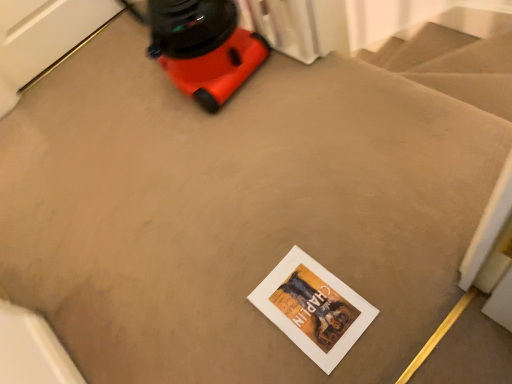
Question: Considering the positions of point (185, 9) and point (286, 279), is point (185, 9) closer or farther from the camera than point (286, 279)?

Choices:
 (A) closer
 (B) farther

Answer: (B)

Question: Visually, is orange plastic vacuum cleaner at upper left positioned to the left or to the right of white matte postcard at center?

Choices:
 (A) left
 (B) right

Answer: (A)

Question: From the image's perspective, is orange plastic vacuum cleaner at upper left located above or below white matte postcard at center?

Choices:
 (A) above
 (B) below

Answer: (A)

Question: Based on their sizes in the image, would you say white matte postcard at center is bigger or smaller than orange plastic vacuum cleaner at upper left?

Choices:
 (A) small
 (B) big

Answer: (A)

Question: From their relative heights in the image, would you say white matte postcard at center is taller or shorter than orange plastic vacuum cleaner at upper left?

Choices:
 (A) tall
 (B) short

Answer: (B)

Question: Considering the positions of white matte postcard at center and orange plastic vacuum cleaner at upper left in the image, is white matte postcard at center wider or thinner than orange plastic vacuum cleaner at upper left?

Choices:
 (A) wide
 (B) thin

Answer: (B)

Question: Is white matte postcard at center inside the boundaries of orange plastic vacuum cleaner at upper left, or outside?

Choices:
 (A) outside
 (B) inside

Answer: (A)